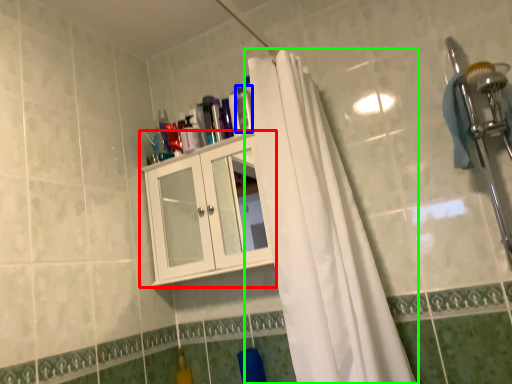
Question: Which is farther away from cabinetry (highlighted by a red box)? toiletry (highlighted by a blue box) or curtain (highlighted by a green box)?

Choices:
 (A) toiletry
 (B) curtain

Answer: (A)